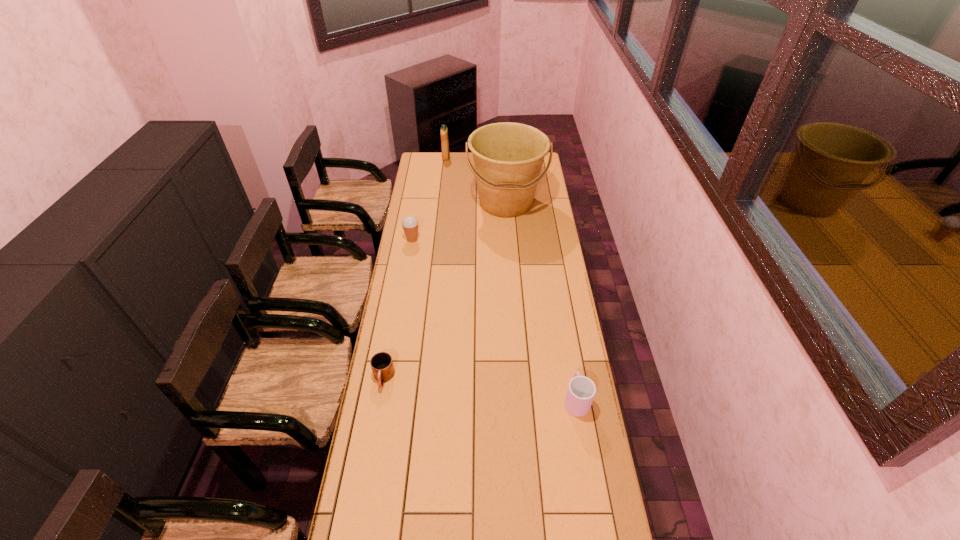
Image resolution: width=960 pixels, height=540 pixels. What are the coordinates of `the tallest object` in the screenshot? It's located at 508,157.

Locate an element on the screen. The height and width of the screenshot is (540, 960). the second farthest object is located at coordinates (508, 157).

What are the coordinates of `detergent` in the screenshot? It's located at (444, 131).

You are a GUI agent. You are given a task and a screenshot of the screen. Output one action in this format:
    pyautogui.click(x=<x>, y=<y>)
    Task: Click on the farthest object
    Image resolution: width=960 pixels, height=540 pixels.
    Given the screenshot: What is the action you would take?
    pyautogui.click(x=444, y=131)

Where is `icecream`? The height and width of the screenshot is (540, 960). icecream is located at coordinates (410, 224).

What are the coordinates of `cup` in the screenshot? It's located at (581, 390).

Find the location of a particular element. mug is located at coordinates (381, 363).

Locate an element on the screen. This screenshot has width=960, height=540. vacant area situated 0.220m on the side of the second farthest object with the handle is located at coordinates (510, 254).

This screenshot has height=540, width=960. I want to click on vacant region located on the label of the farthest object, so click(x=466, y=158).

Find the location of `vacant space located on the back of the third nearest object`. vacant space located on the back of the third nearest object is located at coordinates (419, 201).